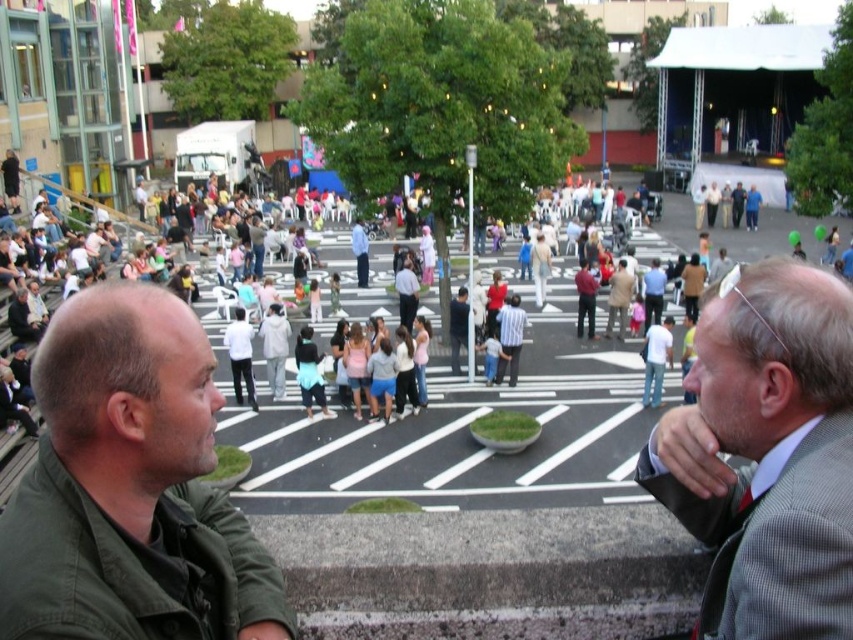
You are a tailor who needs to determine which garment requires more fabric for alterations. Based on the image, which item between the green matte jacket at lower left and the gray wool suit at center would need more fabric due to its thickness?

The gray wool suit at center is thicker than the green matte jacket at lower left, so it would require more fabric for alterations.

You are organizing a photo shoot and need to frame both the green matte jacket at lower left and the gray wool suit at center in the same shot. Considering their sizes, which object should you focus on first to ensure both are visible in the frame?

The green matte jacket at lower left occupies less space than the gray wool suit at center, so you should focus on positioning the gray wool suit at center first to ensure it fits within the frame, then adjust to include the smaller green matte jacket at lower left.